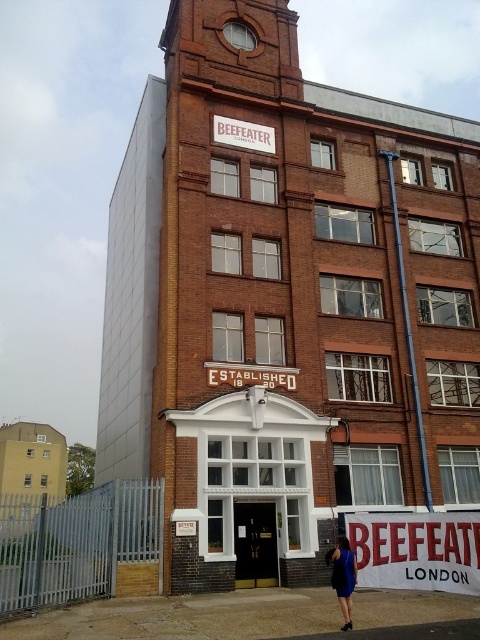
Question: In this image, where is white wooden sign at upper center located relative to blue fabric dress at lower center?

Choices:
 (A) left
 (B) right

Answer: (A)

Question: Which point is farther from the camera taking this photo?

Choices:
 (A) (360, 556)
 (B) (262, 371)
 (C) (354, 573)
 (D) (216, 124)

Answer: (D)

Question: Which of these objects is positioned closest to the white wooden sign at upper center?

Choices:
 (A) white painted wood sign at center
 (B) blue fabric dress at lower center
 (C) white fabric sign at lower center

Answer: (A)

Question: Among these points, which one is farthest from the camera?

Choices:
 (A) (280, 376)
 (B) (457, 576)

Answer: (A)

Question: In this image, where is white wooden sign at upper center located relative to blue fabric dress at lower center?

Choices:
 (A) left
 (B) right

Answer: (A)

Question: Is white painted wood sign at center smaller than blue fabric dress at lower center?

Choices:
 (A) no
 (B) yes

Answer: (A)